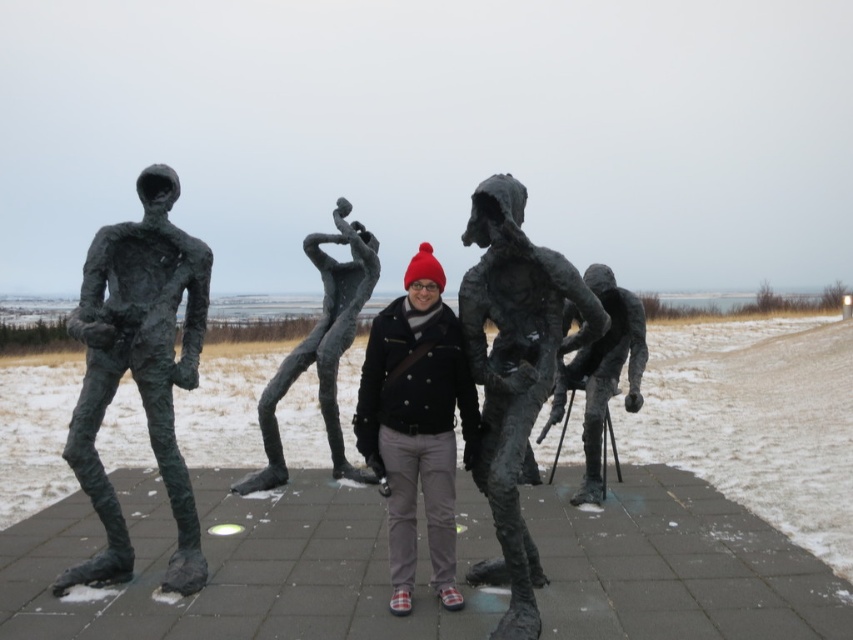
Question: Does bronze textured figure at center appear over bronze textured sculpture at center?

Choices:
 (A) yes
 (B) no

Answer: (B)

Question: Where is bronze textured figure at left located in relation to matte black jacket at center in the image?

Choices:
 (A) below
 (B) above

Answer: (B)

Question: Which of the following is the closest to the observer?

Choices:
 (A) (566, 371)
 (B) (358, 289)

Answer: (A)

Question: Among these objects, which one is farthest from the camera?

Choices:
 (A) bronze sculpture at center
 (B) bronze textured figure at left
 (C) bronze textured figure at center
 (D) matte black jacket at center

Answer: (A)

Question: Does bronze textured figure at left appear over matte black jacket at center?

Choices:
 (A) yes
 (B) no

Answer: (A)

Question: Estimate the real-world distances between objects in this image. Which object is closer to the bronze textured figure at center?

Choices:
 (A) bronze textured sculpture at center
 (B) bronze sculpture at center

Answer: (B)